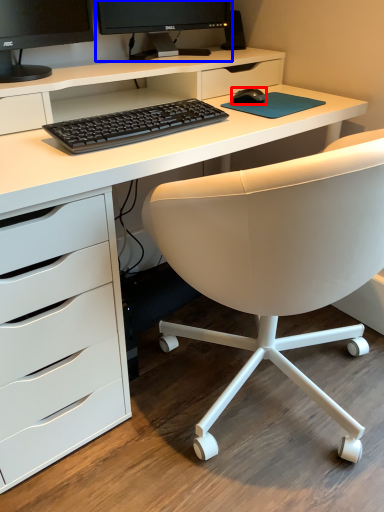
Question: Which of the following is the farthest to the observer, mouse (highlighted by a red box) or computer monitor (highlighted by a blue box)?

Choices:
 (A) mouse
 (B) computer monitor

Answer: (A)